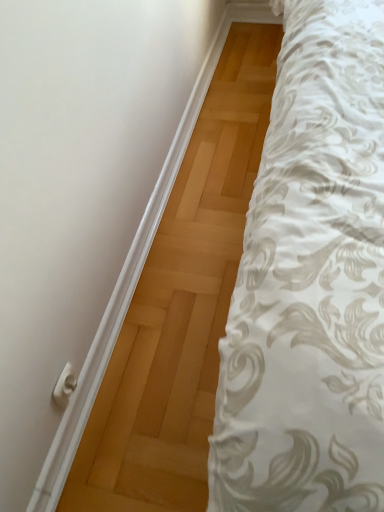
Locate an element on the screen. The image size is (384, 512). white matte door at upper left is located at coordinates (76, 185).

What do you see at coordinates (76, 185) in the screenshot? Image resolution: width=384 pixels, height=512 pixels. I see `white matte door at upper left` at bounding box center [76, 185].

Where is `white plastic door handle at lower left`? Image resolution: width=384 pixels, height=512 pixels. white plastic door handle at lower left is located at coordinates point(65,386).

In order to face white plastic door handle at lower left, should I rotate leftwards or rightwards?

To face it directly, rotate left by 16.520 degrees.

This screenshot has width=384, height=512. What do you see at coordinates (65, 386) in the screenshot?
I see `white plastic door handle at lower left` at bounding box center [65, 386].

The width and height of the screenshot is (384, 512). Find the location of `white matte door at upper left`. white matte door at upper left is located at coordinates (76, 185).

Is white plastic door handle at lower left to the left of white matte door at upper left from the viewer's perspective?

Yes.

Considering the relative positions of white plastic door handle at lower left and white matte door at upper left in the image provided, is white plastic door handle at lower left in front of white matte door at upper left?

No, white plastic door handle at lower left is behind white matte door at upper left.

Considering the positions of point (66, 372) and point (56, 218), is point (66, 372) closer or farther from the camera than point (56, 218)?

Point (66, 372).

From the image's perspective, between white plastic door handle at lower left and white matte door at upper left, which one is located above?

white matte door at upper left, from the image's perspective.

From a real-world perspective, is white plastic door handle at lower left physically above white matte door at upper left?

Yes, from a real-world perspective, white plastic door handle at lower left is on top of white matte door at upper left.

Does white plastic door handle at lower left have a greater width compared to white matte door at upper left?

Incorrect, the width of white plastic door handle at lower left does not surpass that of white matte door at upper left.

Can you confirm if white plastic door handle at lower left is taller than white matte door at upper left?

Yes, white plastic door handle at lower left is taller than white matte door at upper left.

Which of these two, white plastic door handle at lower left or white matte door at upper left, is bigger?

white matte door at upper left is bigger.

Is white matte door at upper left located within white plastic door handle at lower left?

That's incorrect, white matte door at upper left is not inside white plastic door handle at lower left.

Is white plastic door handle at lower left directly adjacent to white matte door at upper left?

white plastic door handle at lower left is not next to white matte door at upper left, and they're not touching.

Is white matte door at upper left at the back of white plastic door handle at lower left?

That's not correct — white plastic door handle at lower left is not looking away from white matte door at upper left.

Find the location of a particular element. This screenshot has height=512, width=384. door lying in front of the white plastic door handle at lower left is located at coordinates (76, 185).

Considering the relative positions of white matte door at upper left and white plastic door handle at lower left in the image provided, is white matte door at upper left to the right of white plastic door handle at lower left from the viewer's perspective?

Yes, white matte door at upper left is to the right of white plastic door handle at lower left.

Does white matte door at upper left lie behind white plastic door handle at lower left?

No.

Considering the positions of points (42, 166) and (68, 365), is point (42, 166) closer to camera compared to point (68, 365)?

Yes, it is in front of point (68, 365).

From the image's perspective, is white matte door at upper left on white plastic door handle at lower left?

Indeed, from the image's perspective, white matte door at upper left is shown above white plastic door handle at lower left.

From a real-world perspective, relative to white plastic door handle at lower left, is white matte door at upper left vertically above or below?

white matte door at upper left is situated lower than white plastic door handle at lower left in the real world.

Considering the sizes of objects white matte door at upper left and white plastic door handle at lower left in the image provided, who is thinner, white matte door at upper left or white plastic door handle at lower left?

white plastic door handle at lower left.

Can you confirm if white matte door at upper left is taller than white plastic door handle at lower left?

No, white matte door at upper left is not taller than white plastic door handle at lower left.

Based on their sizes in the image, would you say white matte door at upper left is bigger or smaller than white plastic door handle at lower left?

Clearly, white matte door at upper left is larger in size than white plastic door handle at lower left.

Would you say white matte door at upper left is outside white plastic door handle at lower left?

Yes, white matte door at upper left is outside of white plastic door handle at lower left.

Is white matte door at upper left in contact with white plastic door handle at lower left?

No, white matte door at upper left is not next to white plastic door handle at lower left.

Could you tell me if white matte door at upper left is facing white plastic door handle at lower left?

No, white matte door at upper left is not turned towards white plastic door handle at lower left.

How different are the orientations of white matte door at upper left and white plastic door handle at lower left in degrees?

There is a 0.0174-degree angle between the facing directions of white matte door at upper left and white plastic door handle at lower left.

Measure the distance between white matte door at upper left and white plastic door handle at lower left.

The distance of white matte door at upper left from white plastic door handle at lower left is 15.40 inches.

Where is `door handle behind the white matte door at upper left`? door handle behind the white matte door at upper left is located at coordinates (65, 386).

Locate an element on the screen. The width and height of the screenshot is (384, 512). door directly beneath the white plastic door handle at lower left (from a real-world perspective) is located at coordinates (76, 185).

Where is `door that appears in front of the white plastic door handle at lower left`? This screenshot has width=384, height=512. door that appears in front of the white plastic door handle at lower left is located at coordinates (76, 185).